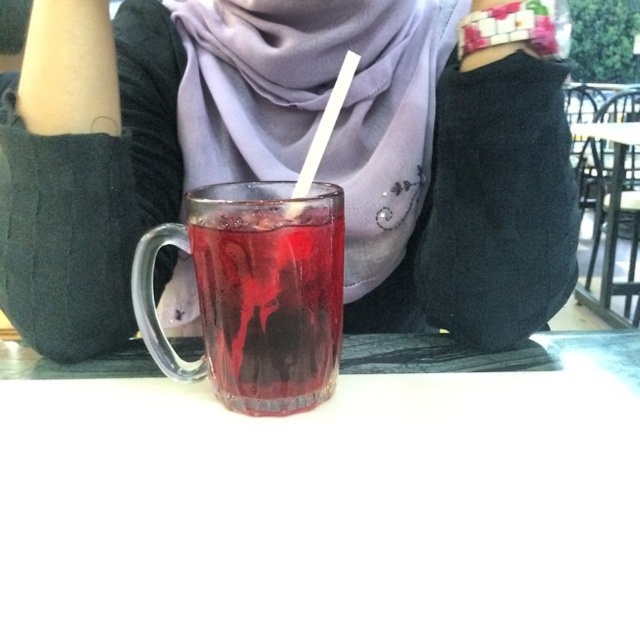
You are a delivery person who needs to place a small package on the table without knocking over the white plastic straw at center. The package is 1 meter wide. Can you safely place it on the transparent glass table at center?

The transparent glass table at center and white plastic straw at center are 1.42 meters apart. Since the package is 1 meter wide, placing it on the table would leave enough space between the package and the straw, so it can be safely placed without knocking it over.

You are a barista at an outdoor cafe. You need to place a new menu board between the matte purple scarf at center and the translucent glass at center. Which object should the menu board be placed closer to if the menu board needs to be closer to the taller object?

The menu board should be placed closer to the matte purple scarf at center because it is much taller than the translucent glass at center.